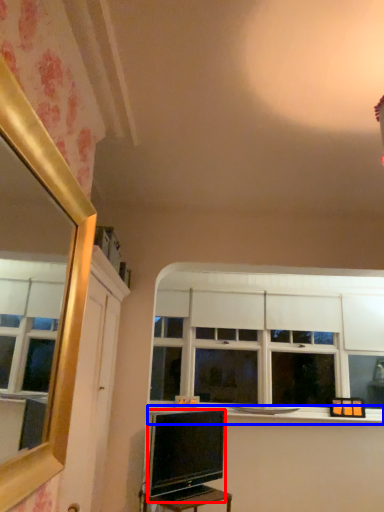
Question: Which point is closer to the camera, television (highlighted by a red box) or window sill (highlighted by a blue box)?

Choices:
 (A) television
 (B) window sill

Answer: (A)